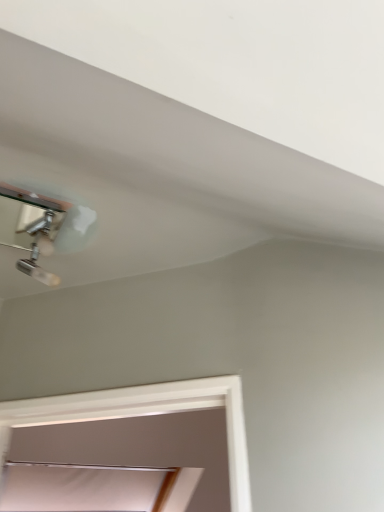
What do you see at coordinates (83, 488) in the screenshot? The image size is (384, 512). I see `white matte window at lower center` at bounding box center [83, 488].

What is the approximate width of white matte window at lower center?

The width of white matte window at lower center is 16.46 inches.

Identify the location of white matte window at lower center. This screenshot has height=512, width=384. (83, 488).

Measure the distance between point (30,201) and camera.

The distance of point (30,201) from camera is 99.80 centimeters.

Describe the element at coordinates (30, 227) in the screenshot. The height and width of the screenshot is (512, 384). I see `chrome metallic lamp at upper left` at that location.

Find the location of a particular element. The image size is (384, 512). chrome metallic lamp at upper left is located at coordinates (30, 227).

Where is `white matte window at lower center`? white matte window at lower center is located at coordinates (83, 488).

Considering the positions of objects white matte window at lower center and chrome metallic lamp at upper left in the image provided, who is more to the right, white matte window at lower center or chrome metallic lamp at upper left?

chrome metallic lamp at upper left is more to the right.

Is the depth of white matte window at lower center greater than that of chrome metallic lamp at upper left?

Yes, it is.

Which is farther, (15, 489) or (19, 193)?

Positioned behind is point (15, 489).

From the image's perspective, which is above, white matte window at lower center or chrome metallic lamp at upper left?

chrome metallic lamp at upper left, from the image's perspective.

From a real-world perspective, is white matte window at lower center positioned under chrome metallic lamp at upper left based on gravity?

Correct, in the physical world, white matte window at lower center is lower than chrome metallic lamp at upper left.

Considering the sizes of objects white matte window at lower center and chrome metallic lamp at upper left in the image provided, who is wider, white matte window at lower center or chrome metallic lamp at upper left?

With larger width is white matte window at lower center.

Considering the relative sizes of white matte window at lower center and chrome metallic lamp at upper left in the image provided, is white matte window at lower center shorter than chrome metallic lamp at upper left?

No.

From the picture: Considering the sizes of objects white matte window at lower center and chrome metallic lamp at upper left in the image provided, who is bigger, white matte window at lower center or chrome metallic lamp at upper left?

white matte window at lower center is bigger.

Consider the image. Is white matte window at lower center spatially inside chrome metallic lamp at upper left, or outside of it?

white matte window at lower center lies outside chrome metallic lamp at upper left.

Are white matte window at lower center and chrome metallic lamp at upper left making contact?

They are not placed beside each other.

Could you tell me if white matte window at lower center is turned towards chrome metallic lamp at upper left?

Yes, white matte window at lower center faces towards chrome metallic lamp at upper left.

Consider the image. What's the angular difference between white matte window at lower center and chrome metallic lamp at upper left's facing directions?

The angle between the facing direction of white matte window at lower center and the facing direction of chrome metallic lamp at upper left is 97.8 degrees.

Where is `lamp above the white matte window at lower center (from a real-world perspective)`? The height and width of the screenshot is (512, 384). lamp above the white matte window at lower center (from a real-world perspective) is located at coordinates (30, 227).

Considering the relative positions of chrome metallic lamp at upper left and white matte window at lower center in the image provided, is chrome metallic lamp at upper left to the left of white matte window at lower center from the viewer's perspective?

Incorrect, chrome metallic lamp at upper left is not on the left side of white matte window at lower center.

Who is more distant, chrome metallic lamp at upper left or white matte window at lower center?

Positioned behind is white matte window at lower center.

Does point (7, 188) appear closer or farther from the camera than point (131, 486)?

Point (7, 188) is positioned closer to the camera compared to point (131, 486).

From the image's perspective, is chrome metallic lamp at upper left located above white matte window at lower center?

Yes, from the image's perspective, chrome metallic lamp at upper left is on top of white matte window at lower center.

In the scene shown: From a real-world perspective, is chrome metallic lamp at upper left physically located above or below white matte window at lower center?

In terms of real-world spatial position, chrome metallic lamp at upper left is above white matte window at lower center.

Is chrome metallic lamp at upper left wider or thinner than white matte window at lower center?

chrome metallic lamp at upper left is thinner than white matte window at lower center.

Who is taller, chrome metallic lamp at upper left or white matte window at lower center?

white matte window at lower center.

Based on their sizes in the image, would you say chrome metallic lamp at upper left is bigger or smaller than white matte window at lower center?

chrome metallic lamp at upper left is smaller than white matte window at lower center.

Would you say chrome metallic lamp at upper left is outside white matte window at lower center?

Absolutely, chrome metallic lamp at upper left is external to white matte window at lower center.

Can you see chrome metallic lamp at upper left touching white matte window at lower center?

No, chrome metallic lamp at upper left is not next to white matte window at lower center.

Is chrome metallic lamp at upper left oriented towards white matte window at lower center?

No, chrome metallic lamp at upper left does not turn towards white matte window at lower center.

How different are the orientations of chrome metallic lamp at upper left and white matte window at lower center in degrees?

They differ by 97.8 degrees in their facing directions.

Measure the distance between chrome metallic lamp at upper left and white matte window at lower center.

chrome metallic lamp at upper left is 6.26 feet away from white matte window at lower center.

The width and height of the screenshot is (384, 512). Identify the location of window that is below the chrome metallic lamp at upper left (from the image's perspective). (83, 488).

Identify the location of window lying behind the chrome metallic lamp at upper left. (83, 488).

This screenshot has width=384, height=512. Identify the location of window lying on the left of chrome metallic lamp at upper left. [83, 488].